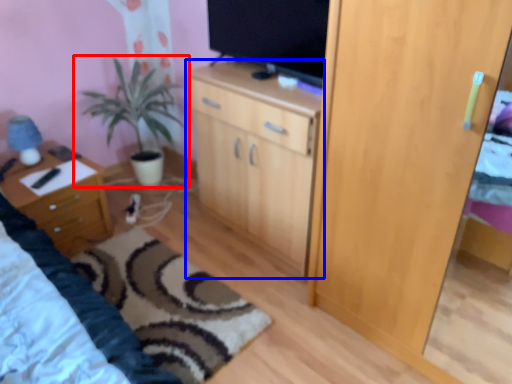
Question: Which object is closer to the camera taking this photo, houseplant (highlighted by a red box) or cabinetry (highlighted by a blue box)?

Choices:
 (A) houseplant
 (B) cabinetry

Answer: (B)